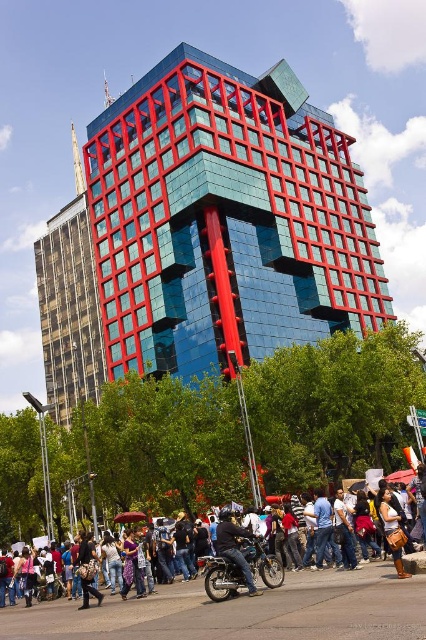
Question: Is shiny chrome motorbike at center to the right of shiny black motorcycle at center from the viewer's perspective?

Choices:
 (A) no
 (B) yes

Answer: (B)

Question: Which object is positioned closest to the matte black crowd at lower center?

Choices:
 (A) shiny black motorcycle at center
 (B) shiny chrome motorbike at center

Answer: (B)

Question: Does matte black crowd at lower center appear over shiny chrome motorbike at center?

Choices:
 (A) yes
 (B) no

Answer: (B)

Question: Considering the real-world distances, which object is farthest from the shiny chrome motorbike at center?

Choices:
 (A) matte black crowd at lower center
 (B) shiny black motorcycle at center

Answer: (A)

Question: Which of the following is the farthest from the observer?

Choices:
 (A) shiny black motorcycle at center
 (B) shiny chrome motorbike at center

Answer: (A)

Question: From the image, what is the correct spatial relationship of matte black crowd at lower center in relation to shiny chrome motorbike at center?

Choices:
 (A) below
 (B) above

Answer: (A)